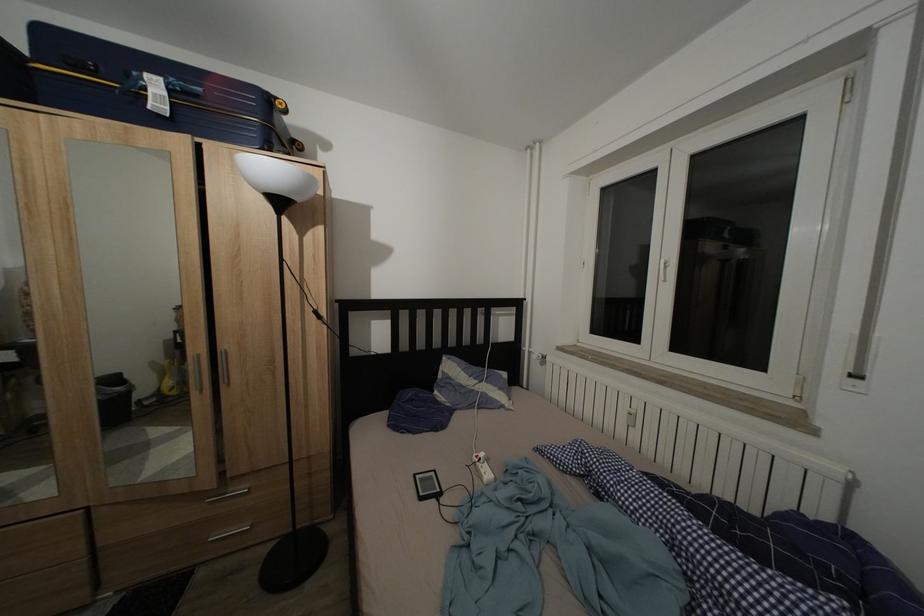
The width and height of the screenshot is (924, 616). I want to click on suitcase handle, so click(160, 84).